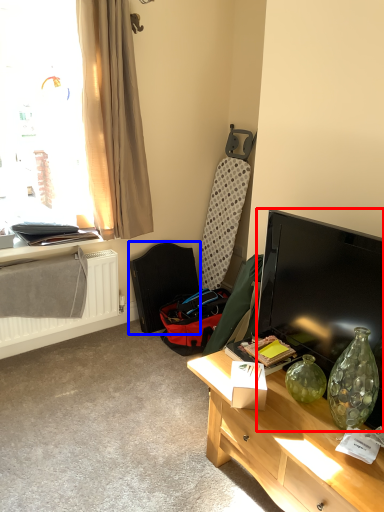
Question: Which object appears closest to the camera in this image, television (highlighted by a red box) or swivel chair (highlighted by a blue box)?

Choices:
 (A) television
 (B) swivel chair

Answer: (A)